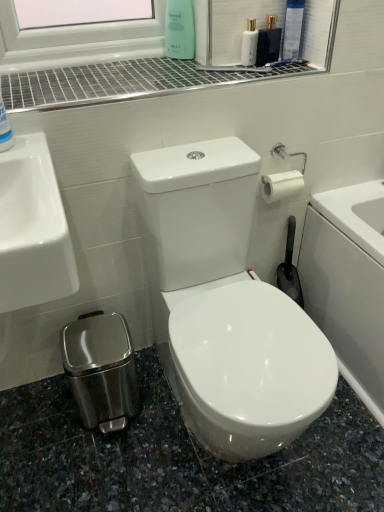
Question: Would you say green matte bottle at upper center, which is counted as the first cleaning product, starting from the right, is inside or outside blue glossy bottle at upper left, placed as the 1th cleaning product when sorted from left to right?

Choices:
 (A) outside
 (B) inside

Answer: (A)

Question: Based on their positions, is green matte bottle at upper center, which ranks as the 2th cleaning product in bottom-to-top order, located to the left or right of blue glossy bottle at upper left, which appears as the 2th cleaning product when viewed from the back?

Choices:
 (A) left
 (B) right

Answer: (B)

Question: Which object is the closest to the green matte bottle at upper center, marked as the first cleaning product in a back-to-front arrangement?

Choices:
 (A) white glossy mouthwash at upper center
 (B) metallic grid at upper center
 (C) white glossy toilet at center
 (D) blue glossy bottle at upper left, placed as the 1th cleaning product when sorted from left to right

Answer: (A)

Question: Which is farther from the green matte bottle at upper center, which appears as the 1th cleaning product when viewed from the top?

Choices:
 (A) blue glossy bottle at upper left, positioned as the first cleaning product in bottom-to-top order
 (B) white glossy mouthwash at upper center
 (C) metallic grid at upper center
 (D) white glossy toilet at center

Answer: (D)